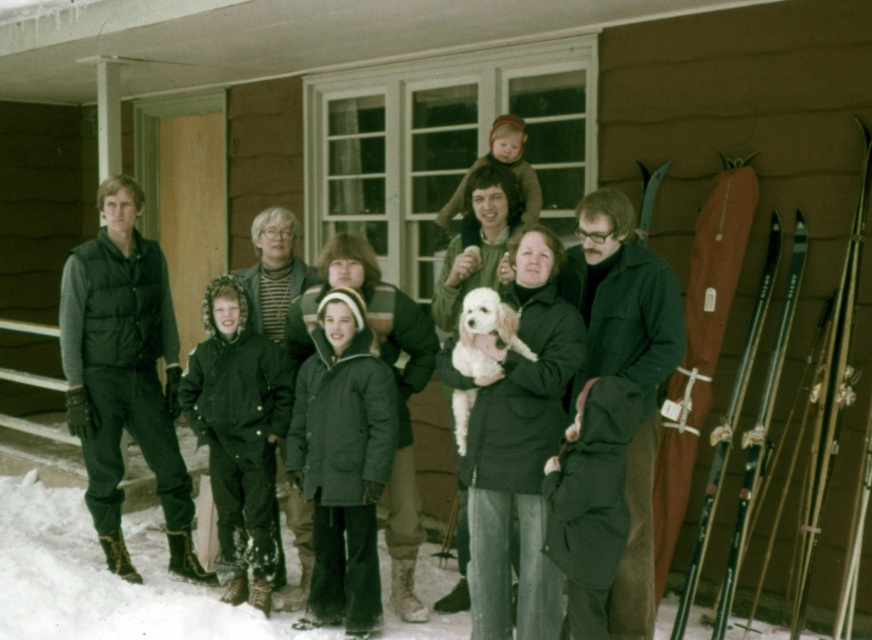
Is dark gray parka at center to the left of wooden ski at right from the viewer's perspective?

Correct, you'll find dark gray parka at center to the left of wooden ski at right.

Which of these two, dark gray parka at center or wooden ski at right, stands shorter?

Standing shorter between the two is dark gray parka at center.

Is point (304, 474) farther from viewer compared to point (863, 138)?

Yes, it is behind point (863, 138).

The height and width of the screenshot is (640, 872). In order to click on dark gray parka at center in this screenshot , I will do `click(342, 461)`.

Locate an element on the screen. The height and width of the screenshot is (640, 872). dark gray puffy jackets at center is located at coordinates (642, 296).

Can you confirm if dark gray puffy jackets at center is taller than wooden ski at right?

In fact, dark gray puffy jackets at center may be shorter than wooden ski at right.

Locate an element on the screen. dark gray puffy jackets at center is located at coordinates (642, 296).

Does point (114, 429) come behind point (693, 586)?

Yes, it is behind point (693, 586).

Between point (144, 330) and point (765, 285), which one is positioned behind?

The point (144, 330) is behind.

Locate an element on the screen. This screenshot has height=640, width=872. dark green puffy vest at left is located at coordinates (124, 374).